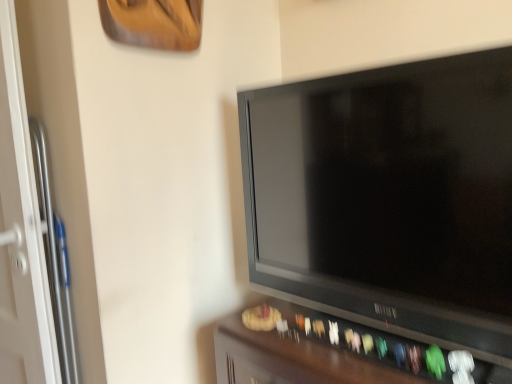
Question: From a real-world perspective, is black glossy tv at center physically below dark wood tv stand at lower center?

Choices:
 (A) no
 (B) yes

Answer: (A)

Question: Can you confirm if black glossy tv at center is positioned to the left of dark wood tv stand at lower center?

Choices:
 (A) yes
 (B) no

Answer: (A)

Question: Is black glossy tv at center positioned behind dark wood tv stand at lower center?

Choices:
 (A) yes
 (B) no

Answer: (B)

Question: Is black glossy tv at center not inside dark wood tv stand at lower center?

Choices:
 (A) no
 (B) yes

Answer: (B)

Question: Can you see black glossy tv at center touching dark wood tv stand at lower center?

Choices:
 (A) no
 (B) yes

Answer: (A)

Question: Does black glossy tv at center have a greater height compared to dark wood tv stand at lower center?

Choices:
 (A) no
 (B) yes

Answer: (B)

Question: From the image's perspective, is dark wood tv stand at lower center below black glossy tv at center?

Choices:
 (A) no
 (B) yes

Answer: (B)

Question: Would you consider dark wood tv stand at lower center to be distant from black glossy tv at center?

Choices:
 (A) yes
 (B) no

Answer: (B)

Question: Would you say dark wood tv stand at lower center is outside black glossy tv at center?

Choices:
 (A) yes
 (B) no

Answer: (A)

Question: From a real-world perspective, is dark wood tv stand at lower center positioned under black glossy tv at center based on gravity?

Choices:
 (A) no
 (B) yes

Answer: (B)

Question: Is dark wood tv stand at lower center bigger than black glossy tv at center?

Choices:
 (A) yes
 (B) no

Answer: (A)

Question: Can you confirm if dark wood tv stand at lower center is smaller than black glossy tv at center?

Choices:
 (A) yes
 (B) no

Answer: (B)

Question: Would you say dark wood tv stand at lower center is inside or outside black glossy tv at center?

Choices:
 (A) outside
 (B) inside

Answer: (A)